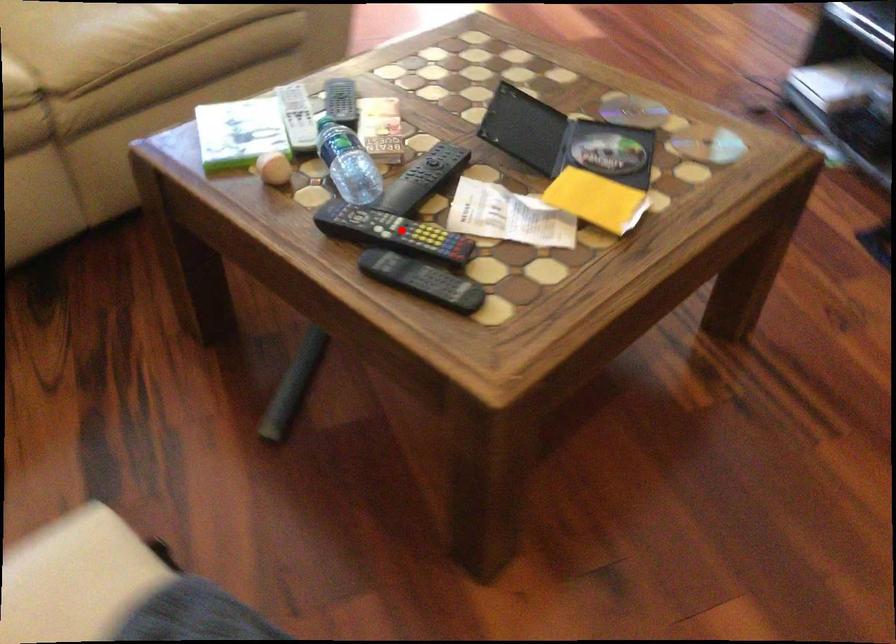
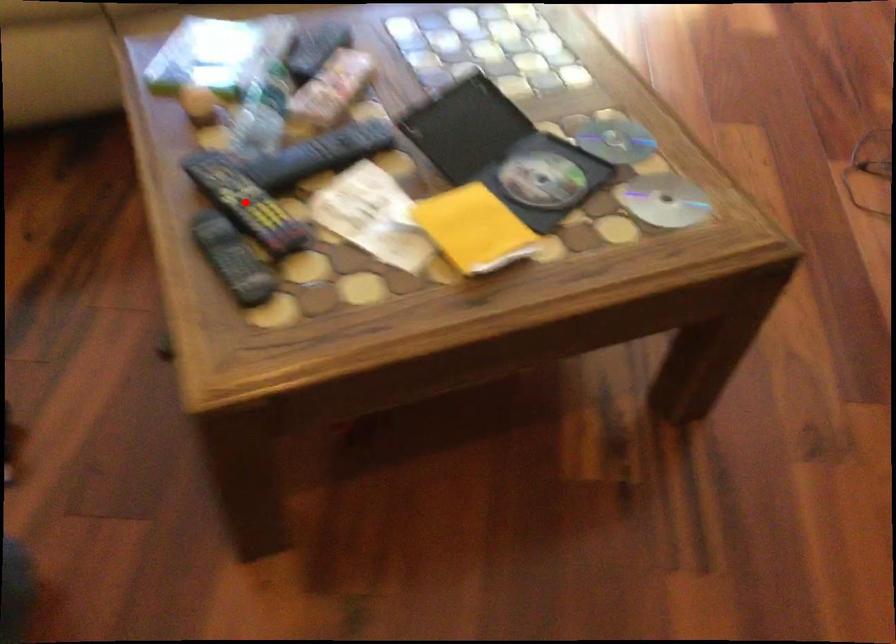
I am providing you with two images of the same scene from different viewpoints. A red point is marked on the first image and another point is marked on the second image. Is the marked point in image1 the same physical position as the marked point in image2?

Yes